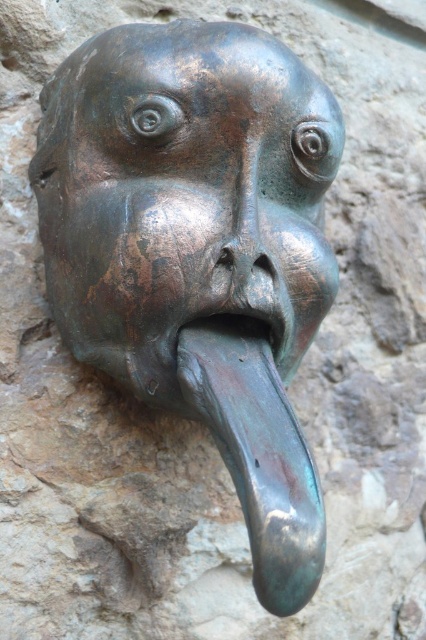
What are the coordinates of the bronze textured nose at center in the image?

The bronze textured nose at center is located at point coordinates of [247,252].

You are an art restorer examining the metallic sculpture. You need to determine which part requires more vertical space for restoration between the bronze textured nose at center and the shiny bronze mouth at center. Which one do you think needs more vertical space?

The bronze textured nose at center is much taller than the shiny bronze mouth at center, so it requires more vertical space for restoration.

Consider the image. You are an art conservator assessing the bronze sculpture at center and the shiny bronze mouth at center. Which part requires more attention to prevent further oxidation, and why?

The bronze sculpture at center requires more attention because it is larger in size than the shiny bronze mouth at center, making it more susceptible to environmental exposure and oxidation over time.